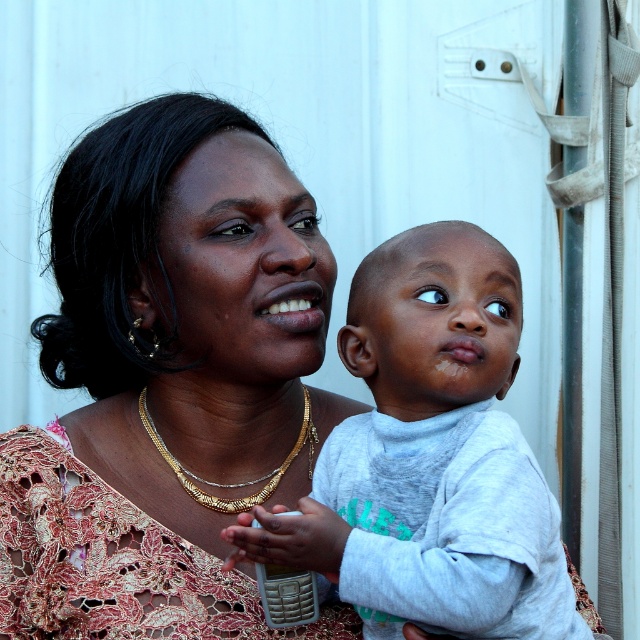
What are the coordinates of the matte gold necklace at center?

The coordinates of the matte gold necklace at center are at point (168,380).

You are a photographer adjusting the lighting in this scene. You need to ensure that both the matte gold necklace at center and the gold chain necklace at center are clearly visible. Which necklace should you focus the light on first to highlight its details?

The matte gold necklace at center is in front of the gold chain necklace at center, so you should focus the light on the matte gold necklace at center first to ensure it doesn